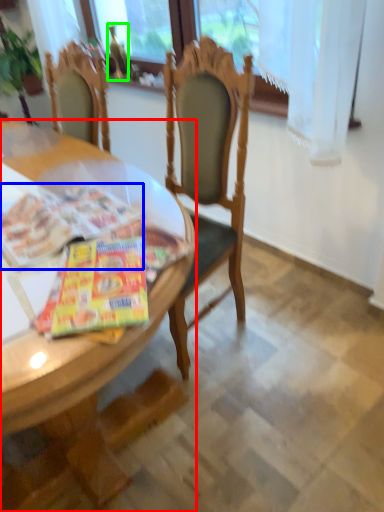
Question: Which object is the closest to the desk (highlighted by a red box)? Choose among these: magazine (highlighted by a blue box) or bottle (highlighted by a green box).

Choices:
 (A) magazine
 (B) bottle

Answer: (A)